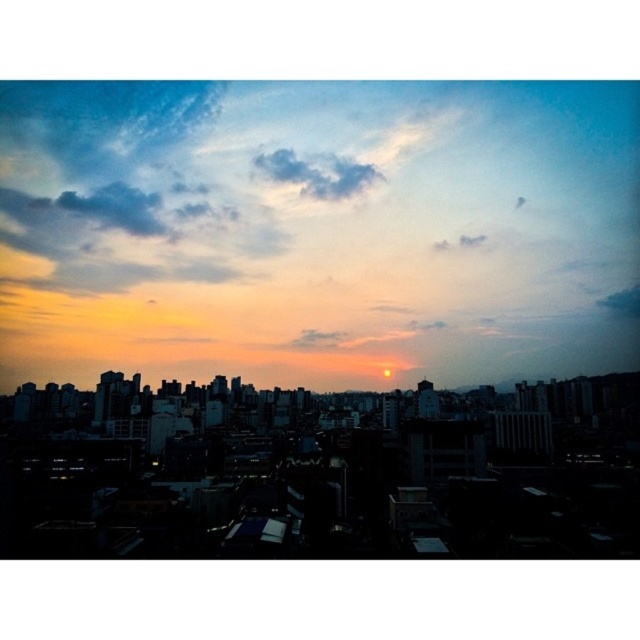
You are an architect analyzing the cityscape. You notice two areas of the sky, the cloudy sky at center and the cloudy sky at upper center. Which of these two areas appears closer to you based on their positions?

The cloudy sky at center appears closer to you because it is positioned closer to the viewer than the cloudy sky at upper center.

You are an astronomer analyzing the cityscape image. You notice a point at coordinates point (316, 230). Based on the scene description, what does this point likely represent?

The point (316, 230) corresponds to the cloudy sky at center, as stated in the objects description.

You are an urban planner analyzing the cityscape. You notice two cloudy areas in the sky. Which of the two cloudy regions, the cloudy sky at center or the cloudy sky at upper center, is positioned to the right of the other?

The cloudy sky at center is positioned to the right of the cloudy sky at upper center.